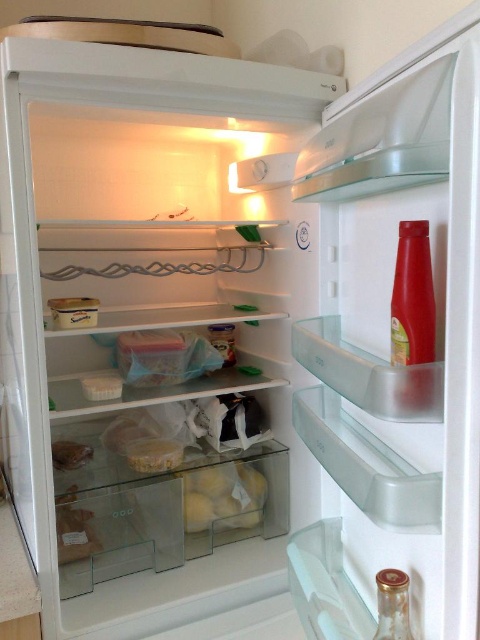
You are a delivery person who just placed two packages at the specified coordinates inside the fridge. The first package is at point (88, 528) and the second at point (58, 456). Since you need to retrieve the closer one first, which coordinate should you go to?

Point (88, 528) is closer to the camera than point (58, 456), so you should retrieve the package at point (88, 528) first.

You are organizing the fridge and need to place a new bag of carrots. The carrots require a space that is at least 10 cm wide. Can the space at point (223, 497) accommodate the carrots?

The space at point (223, 497) has a translucent plastic bag of potatoes which is 8 cm wide. Since the carrots require 10 cm, the space is insufficient.

You are organizing the fridge and want to move the translucent plastic bag at lower left to the back of the shelf to make space. Can you move it behind the translucent plastic container at center?

The translucent plastic bag at lower left is currently in front of the translucent plastic container at center, so you can move it behind the container to create more space.